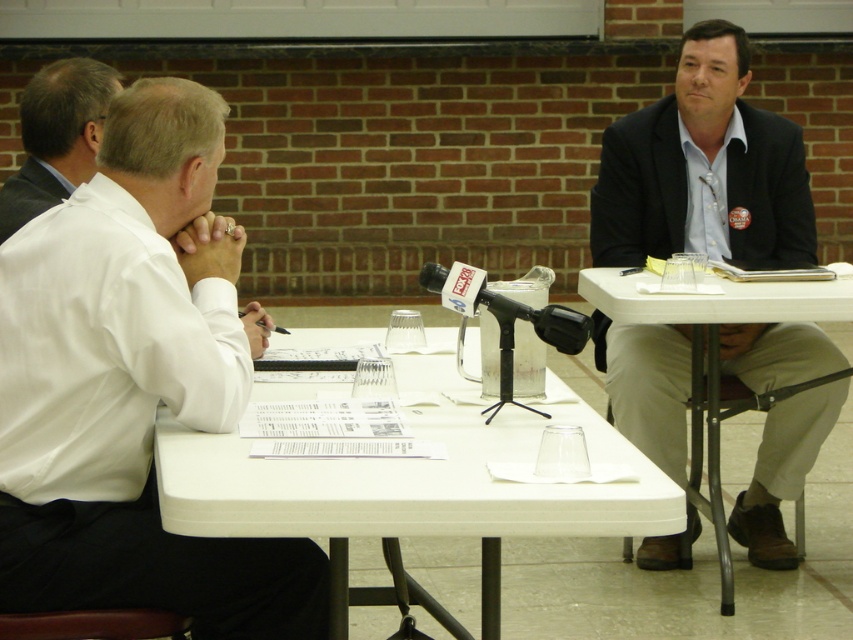
Is white plastic table at center smaller than white smooth shirt at left?

Incorrect, white plastic table at center is not smaller in size than white smooth shirt at left.

Who is higher up, white plastic table at center or white smooth shirt at left?

white smooth shirt at left is higher up.

Who is more distant from viewer, (646, 512) or (56, 81)?

Point (56, 81)

Identify the location of white plastic table at center. Image resolution: width=853 pixels, height=640 pixels. (409, 493).

Is dark gray suit at right positioned in front of white smooth shirt at left?

No, it is behind white smooth shirt at left.

Which is behind, point (824, 346) or point (41, 140)?

The point (824, 346) is behind.

Is point (634, 413) positioned behind point (97, 131)?

That is True.

Identify the location of dark gray suit at right. (703, 168).

Which is behind, point (158, 172) or point (97, 100)?

Point (97, 100)

Can you confirm if white shirt at left is taller than white smooth shirt at left?

Yes, white shirt at left is taller than white smooth shirt at left.

Is point (0, 266) positioned after point (112, 81)?

That is False.

Image resolution: width=853 pixels, height=640 pixels. What are the coordinates of `white shirt at left` in the screenshot? It's located at (134, 385).